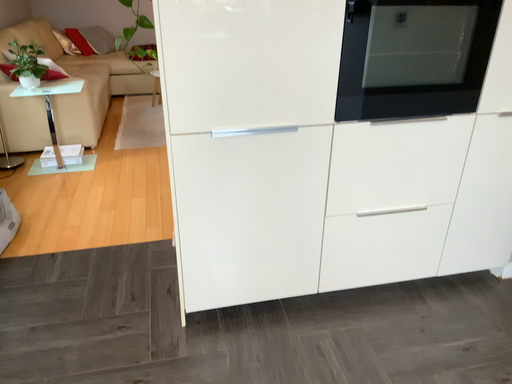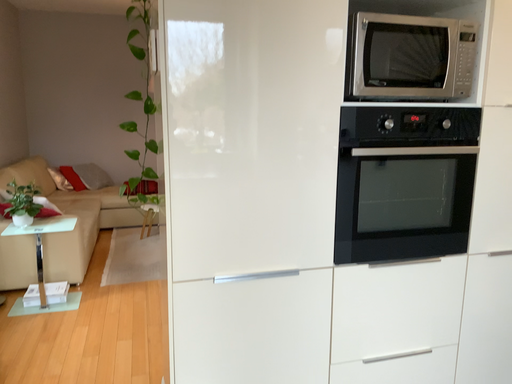
Question: Which way did the camera rotate in the video?

Choices:
 (A) rotated upward
 (B) rotated downward

Answer: (A)